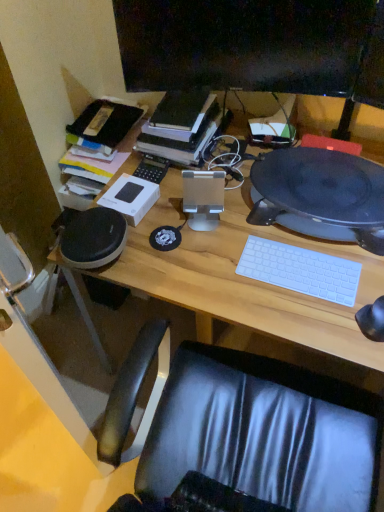
I want to click on vacant space that's between white matte keyboard at center and black matte speaker at right, so click(298, 250).